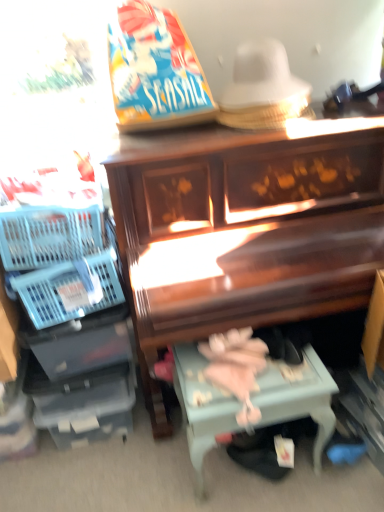
The height and width of the screenshot is (512, 384). What are the coordinates of `wooden piano at center` in the screenshot? It's located at (245, 229).

Considering the relative sizes of wooden piano at center and light blue painted wood table at lower center in the image provided, is wooden piano at center taller than light blue painted wood table at lower center?

Yes, wooden piano at center is taller than light blue painted wood table at lower center.

Is wooden piano at center far from light blue painted wood table at lower center?

No, wooden piano at center is not far from light blue painted wood table at lower center.

From the image's perspective, is wooden piano at center located above or below light blue painted wood table at lower center?

Based on their image positions, wooden piano at center is located above light blue painted wood table at lower center.

How distant is wooden piano at center from light blue painted wood table at lower center?

The distance of wooden piano at center from light blue painted wood table at lower center is 39.79 centimeters.

Locate an element on the screen. The height and width of the screenshot is (512, 384). furniture to the right of blue plastic basket at left is located at coordinates (245, 229).

Which of these two, blue plastic basket at left or wooden piano at center, is smaller?

Smaller between the two is blue plastic basket at left.

Is blue plastic basket at left facing towards wooden piano at center?

No, blue plastic basket at left is not oriented towards wooden piano at center.

Which object is positioned more to the right, blue plastic basket at left or wooden piano at center?

wooden piano at center is more to the right.

From the image's perspective, is wooden piano at center on top of blue plastic basket at left?

No, from the image's perspective, wooden piano at center is not over blue plastic basket at left.

Locate an element on the screen. The width and height of the screenshot is (384, 512). furniture below the blue plastic basket at left (from the image's perspective) is located at coordinates (245, 229).

Do you think wooden piano at center is within blue plastic basket at left, or outside of it?

wooden piano at center is located beyond the bounds of blue plastic basket at left.

Considering the positions of objects wooden piano at center and blue plastic basket at left in the image provided, who is more to the right, wooden piano at center or blue plastic basket at left?

Positioned to the right is wooden piano at center.

Considering the relative positions of light blue painted wood table at lower center and blue plastic basket at left in the image provided, is light blue painted wood table at lower center to the right of blue plastic basket at left from the viewer's perspective?

Yes, light blue painted wood table at lower center is to the right of blue plastic basket at left.

Who is smaller, light blue painted wood table at lower center or blue plastic basket at left?

blue plastic basket at left.

From a real-world perspective, is light blue painted wood table at lower center positioned over blue plastic basket at left based on gravity?

No, from a real-world perspective, light blue painted wood table at lower center is not on top of blue plastic basket at left.

Is the depth of light blue painted wood table at lower center less than that of blue plastic basket at left?

Yes, the depth of light blue painted wood table at lower center is less than that of blue plastic basket at left.

Between light blue painted wood table at lower center and wooden piano at center, which one appears on the left side from the viewer's perspective?

light blue painted wood table at lower center.

Is point (190, 431) positioned after point (233, 308)?

Yes, it is.

Looking at this image, from the image's perspective, is light blue painted wood table at lower center located above or below wooden piano at center?

light blue painted wood table at lower center is below wooden piano at center.

Is the position of light blue painted wood table at lower center less distant than that of wooden piano at center?

No, it is behind wooden piano at center.

From a real-world perspective, is blue plastic basket at left physically above light blue painted wood table at lower center?

Yes, from a real-world perspective, blue plastic basket at left is over light blue painted wood table at lower center

Which object is further away from the camera taking this photo, blue plastic basket at left or light blue painted wood table at lower center?

blue plastic basket at left is further from the camera.

Could light blue painted wood table at lower center be considered to be inside blue plastic basket at left?

No, light blue painted wood table at lower center is not inside blue plastic basket at left.

Does point (56, 282) come behind point (259, 397)?

Yes, it is behind point (259, 397).

The height and width of the screenshot is (512, 384). I want to click on table below the wooden piano at center (from a real-world perspective), so click(x=297, y=397).

Where is `basket above the wooden piano at center (from a real-world perspective)`? This screenshot has width=384, height=512. basket above the wooden piano at center (from a real-world perspective) is located at coordinates (70, 289).

Looking at the image, which one is located closer to light blue painted wood table at lower center, wooden piano at center or blue plastic basket at left?

Among the two, wooden piano at center is located nearer to light blue painted wood table at lower center.

Which object lies nearer to the anchor point blue plastic basket at left, wooden piano at center or light blue painted wood table at lower center?

Among the two, wooden piano at center is located nearer to blue plastic basket at left.

From the image, which object appears to be farther from wooden piano at center, blue plastic basket at left or light blue painted wood table at lower center?

blue plastic basket at left.

Estimate the real-world distances between objects in this image. Which object is closer to light blue painted wood table at lower center, blue plastic basket at left or wooden piano at center?

Based on the image, wooden piano at center appears to be nearer to light blue painted wood table at lower center.

Estimate the real-world distances between objects in this image. Which object is further from blue plastic basket at left, light blue painted wood table at lower center or wooden piano at center?

Among the two, light blue painted wood table at lower center is located further to blue plastic basket at left.

Looking at the image, which one is located further to wooden piano at center, light blue painted wood table at lower center or blue plastic basket at left?

The object further to wooden piano at center is blue plastic basket at left.

This screenshot has width=384, height=512. What are the coordinates of `table situated between blue plastic basket at left and wooden piano at center from left to right` in the screenshot? It's located at (297, 397).